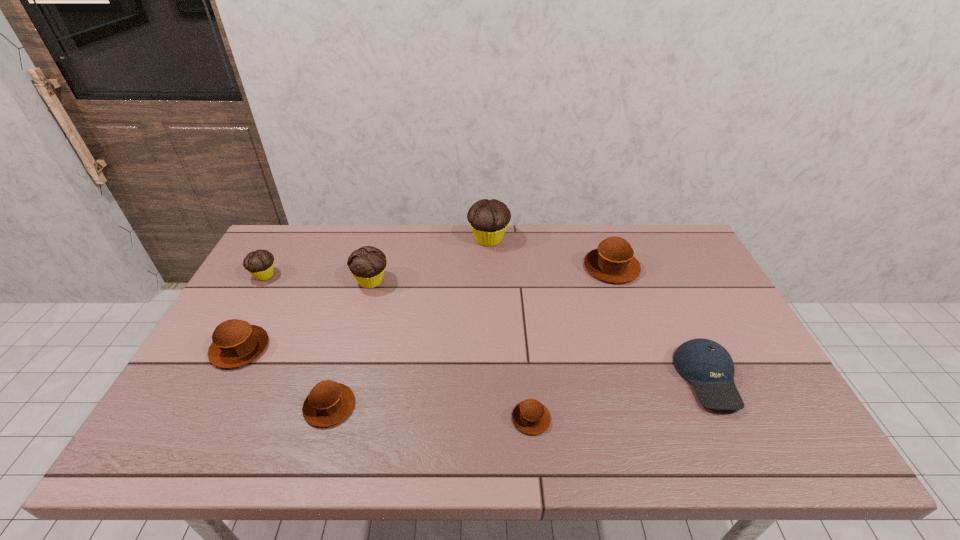
This screenshot has height=540, width=960. Find the location of `the sixth tallest muffin`. the sixth tallest muffin is located at coordinates (328, 403).

Locate an element on the screen. the shortest object is located at coordinates pos(530,416).

Image resolution: width=960 pixels, height=540 pixels. I want to click on the smallest brown muffin, so click(530, 416).

This screenshot has width=960, height=540. Identify the location of vacant space located on the right of the biggest chocolate muffin. (612, 239).

I want to click on free spot located on the front of the second chocolate muffin from right to left, so click(344, 379).

At what (x,y) coordinates should I click in order to perform the action: click on vacant space situated on the left of the farthest brown muffin. Please return your answer as a coordinate pair (x, y). This screenshot has width=960, height=540. Looking at the image, I should click on (507, 267).

Image resolution: width=960 pixels, height=540 pixels. What are the coordinates of `vacant space located on the right of the fifth farthest muffin` in the screenshot? It's located at (384, 348).

At what (x,y) coordinates should I click in order to perform the action: click on free space located 0.370m on the front of the leftmost chocolate muffin. Please return your answer as a coordinate pair (x, y). The width and height of the screenshot is (960, 540). Looking at the image, I should click on (203, 384).

Identify the location of vacant space located 0.050m on the front-facing side of the blue baseball cap. (735, 436).

Locate an element on the screen. free region located 0.100m on the left of the third biggest brown muffin is located at coordinates (262, 406).